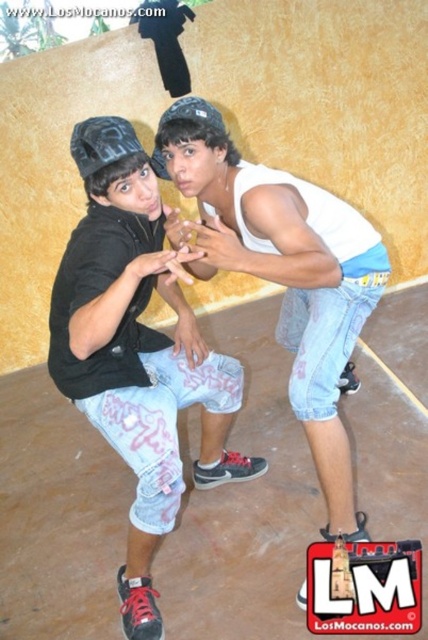
Between denim shorts at center and white cotton tank top at upper center, which one is positioned lower?

denim shorts at center

Is point (95, 170) more distant than point (332, 496)?

No, it is not.

Where is `denim shorts at center`? The image size is (428, 640). denim shorts at center is located at coordinates (136, 353).

The image size is (428, 640). Identify the location of denim shorts at center. (x=136, y=353).